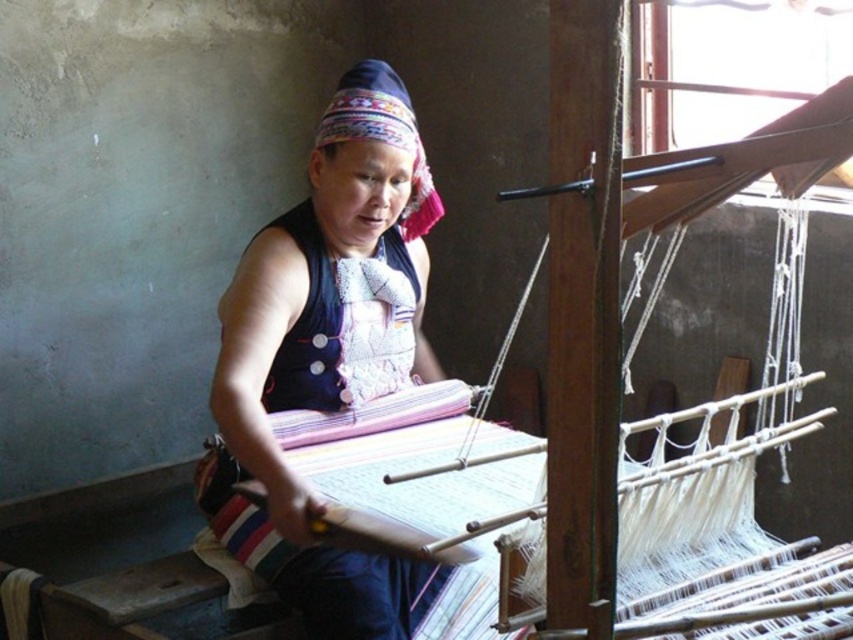
This screenshot has height=640, width=853. I want to click on matte black fabric at center, so click(328, 353).

Is matte black fabric at center wider than blue fabric apron at center?

Indeed, matte black fabric at center has a greater width compared to blue fabric apron at center.

Describe the element at coordinates (328, 353) in the screenshot. I see `matte black fabric at center` at that location.

At what (x,y) coordinates should I click in order to perform the action: click on matte black fabric at center. Please return your answer as a coordinate pair (x, y). Looking at the image, I should click on (328, 353).

Is point (299, 324) more distant than point (387, 125)?

Yes, point (299, 324) is behind point (387, 125).

Who is positioned more to the left, blue fabric apron at center or embroidered fabric headscarf at center?

blue fabric apron at center

Describe the element at coordinates (344, 323) in the screenshot. I see `blue fabric apron at center` at that location.

Locate an element on the screen. The image size is (853, 640). blue fabric apron at center is located at coordinates (344, 323).

Can you confirm if matte black fabric at center is smaller than embroidered fabric headscarf at center?

No, matte black fabric at center is not smaller than embroidered fabric headscarf at center.

Can you confirm if matte black fabric at center is positioned to the right of embroidered fabric headscarf at center?

In fact, matte black fabric at center is to the left of embroidered fabric headscarf at center.

You are a GUI agent. You are given a task and a screenshot of the screen. Output one action in this format:
    pyautogui.click(x=<x>, y=<y>)
    Task: Click on the matte black fabric at center
    The image size is (853, 640).
    Given the screenshot: What is the action you would take?
    pyautogui.click(x=328, y=353)

You are a GUI agent. You are given a task and a screenshot of the screen. Output one action in this format:
    pyautogui.click(x=<x>, y=<y>)
    Task: Click on the matte black fabric at center
    The image size is (853, 640).
    Given the screenshot: What is the action you would take?
    pyautogui.click(x=328, y=353)